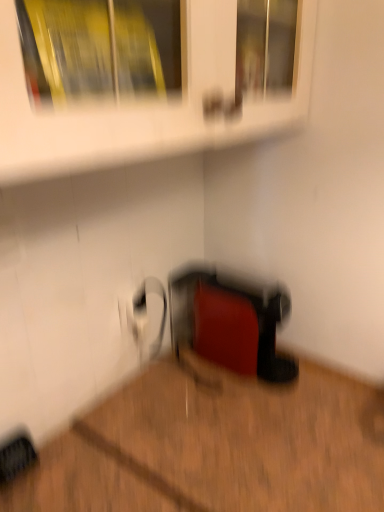
This screenshot has width=384, height=512. I want to click on free spot below white glossy shelf at upper center (from a real-world perspective), so click(146, 426).